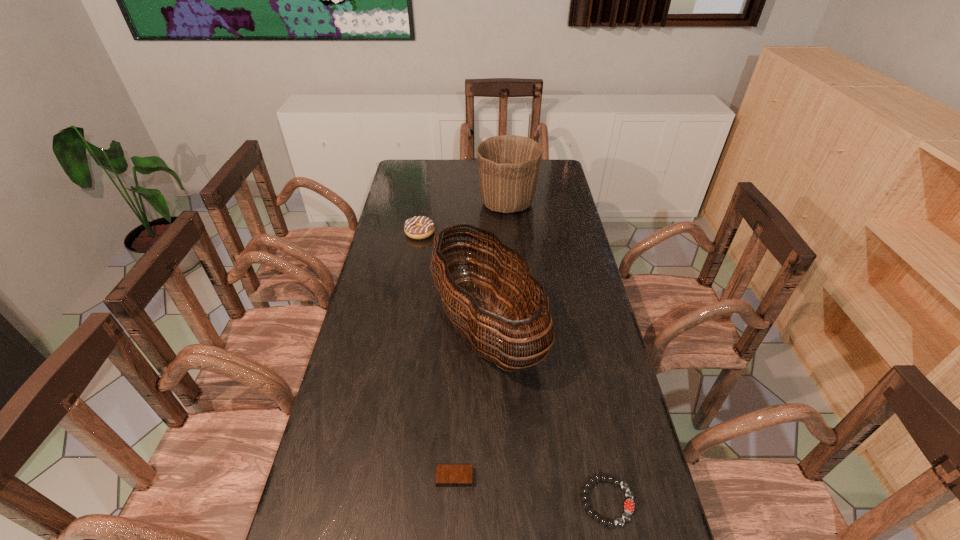
You are a GUI agent. You are given a task and a screenshot of the screen. Output one action in this format:
    pyautogui.click(x=<x>, y=<y>)
    Task: Click on the farthest object
    
    Given the screenshot: What is the action you would take?
    pyautogui.click(x=508, y=165)

I want to click on the third nearest object, so click(x=481, y=325).

Find the location of `doughnut`. doughnut is located at coordinates (419, 227).

Identify the location of the fourth nearest object. Image resolution: width=960 pixels, height=540 pixels. click(419, 227).

Find the location of a particular element. alarm clock is located at coordinates (446, 475).

At what (x,y) coordinates should I click in order to perform the action: click on bracelet. Please return your answer as a coordinate pair (x, y). The height and width of the screenshot is (540, 960). Looking at the image, I should click on pos(629,506).

I want to click on vacant space located 0.130m on the left of the farthest object, so coord(445,203).

Where is `vacant space situated 0.210m on the back of the third nearest object`? This screenshot has height=540, width=960. vacant space situated 0.210m on the back of the third nearest object is located at coordinates (485, 238).

You are a GUI agent. You are given a task and a screenshot of the screen. Output one action in this format:
    pyautogui.click(x=<x>, y=<y>)
    Task: Click on the vacant position located on the back of the second farthest object
    
    Given the screenshot: What is the action you would take?
    pyautogui.click(x=423, y=213)

Where is `vacant area situated 0.060m on the front face of the alarm clock`? Image resolution: width=960 pixels, height=540 pixels. vacant area situated 0.060m on the front face of the alarm clock is located at coordinates (453, 516).